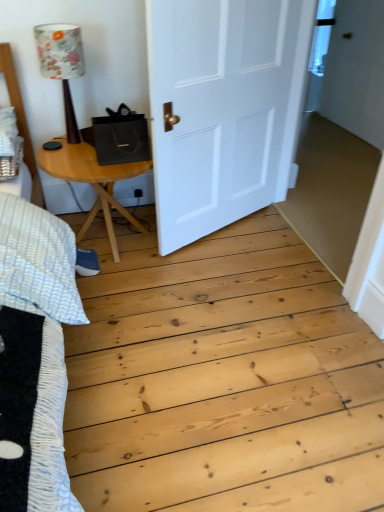
Question: Considering the relative sizes of white matte door at center and light brown wooden table at left in the image provided, is white matte door at center taller than light brown wooden table at left?

Choices:
 (A) yes
 (B) no

Answer: (A)

Question: Is white matte door at center not within light brown wooden table at left?

Choices:
 (A) yes
 (B) no

Answer: (A)

Question: Is light brown wooden table at left at the back of white matte door at center?

Choices:
 (A) yes
 (B) no

Answer: (B)

Question: Is white matte door at center at the right side of light brown wooden table at left?

Choices:
 (A) yes
 (B) no

Answer: (A)

Question: Considering the relative positions of white matte door at center and light brown wooden table at left in the image provided, is white matte door at center in front of light brown wooden table at left?

Choices:
 (A) no
 (B) yes

Answer: (B)

Question: Based on their sizes in the image, would you say white matte door at center is bigger or smaller than floral fabric lampshade at upper left?

Choices:
 (A) small
 (B) big

Answer: (B)

Question: Is white matte door at center in front of or behind floral fabric lampshade at upper left in the image?

Choices:
 (A) front
 (B) behind

Answer: (A)

Question: Does point (145, 11) appear closer or farther from the camera than point (57, 24)?

Choices:
 (A) farther
 (B) closer

Answer: (A)

Question: From their relative heights in the image, would you say white matte door at center is taller or shorter than floral fabric lampshade at upper left?

Choices:
 (A) tall
 (B) short

Answer: (A)

Question: Considering their positions, is light brown wooden table at left located in front of or behind white matte door at center?

Choices:
 (A) behind
 (B) front

Answer: (A)

Question: From the image's perspective, is light brown wooden table at left positioned above or below white matte door at center?

Choices:
 (A) above
 (B) below

Answer: (B)

Question: Is light brown wooden table at left taller or shorter than white matte door at center?

Choices:
 (A) tall
 (B) short

Answer: (B)

Question: Based on their positions, is light brown wooden table at left located to the left or right of white matte door at center?

Choices:
 (A) left
 (B) right

Answer: (A)

Question: Is floral fabric lampshade at upper left wider or thinner than light brown wooden table at left?

Choices:
 (A) thin
 (B) wide

Answer: (A)

Question: Is floral fabric lampshade at upper left bigger or smaller than light brown wooden table at left?

Choices:
 (A) small
 (B) big

Answer: (A)